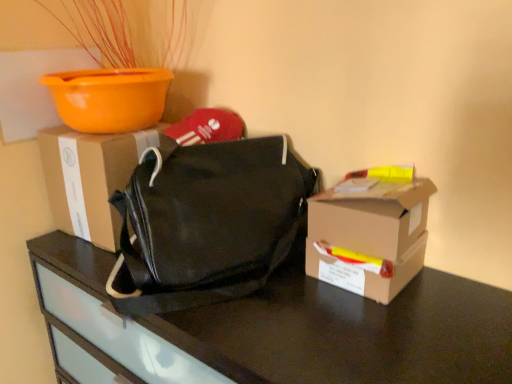
Question: Is orange plastic bowl at upper left at the right side of black matte bag at center?

Choices:
 (A) no
 (B) yes

Answer: (A)

Question: From a real-world perspective, is orange plastic bowl at upper left on top of black matte bag at center?

Choices:
 (A) yes
 (B) no

Answer: (A)

Question: Is orange plastic bowl at upper left placed right next to black matte bag at center?

Choices:
 (A) yes
 (B) no

Answer: (B)

Question: Is orange plastic bowl at upper left far away from black matte bag at center?

Choices:
 (A) no
 (B) yes

Answer: (A)

Question: Does orange plastic bowl at upper left have a greater width compared to black matte bag at center?

Choices:
 (A) yes
 (B) no

Answer: (B)

Question: Relative to orange plastic bowl at upper left, is matte cardboard box at center, the 1th box viewed from the back, in front or behind?

Choices:
 (A) front
 (B) behind

Answer: (B)

Question: Is point pos(62,157) closer or farther from the camera than point pos(172,39)?

Choices:
 (A) farther
 (B) closer

Answer: (B)

Question: In the image, is matte cardboard box at center, the 1th box viewed from the back, on the left side or the right side of orange plastic bowl at upper left?

Choices:
 (A) left
 (B) right

Answer: (A)

Question: From a real-world perspective, is matte cardboard box at center, arranged as the 2th box when viewed from the right, above or below orange plastic bowl at upper left?

Choices:
 (A) below
 (B) above

Answer: (A)

Question: Considering the positions of black matte bag at center and matte cardboard box at center, the second box from the front, in the image, is black matte bag at center taller or shorter than matte cardboard box at center, the second box from the front,?

Choices:
 (A) short
 (B) tall

Answer: (B)

Question: Looking at their shapes, would you say black matte bag at center is wider or thinner than matte cardboard box at center, arranged as the 2th box when viewed from the right?

Choices:
 (A) thin
 (B) wide

Answer: (B)

Question: Considering the positions of black matte bag at center and matte cardboard box at center, the second box from the front, in the image, is black matte bag at center bigger or smaller than matte cardboard box at center, the second box from the front,?

Choices:
 (A) big
 (B) small

Answer: (A)

Question: From a real-world perspective, is black matte bag at center above or below matte cardboard box at center, the 1th box viewed from the back?

Choices:
 (A) below
 (B) above

Answer: (A)

Question: From the image's perspective, is brown cardboard box at right, placed as the 2th box when sorted from back to front, positioned above or below orange plastic bowl at upper left?

Choices:
 (A) above
 (B) below

Answer: (B)

Question: Considering the positions of point (378, 218) and point (93, 97), is point (378, 218) closer or farther from the camera than point (93, 97)?

Choices:
 (A) farther
 (B) closer

Answer: (B)